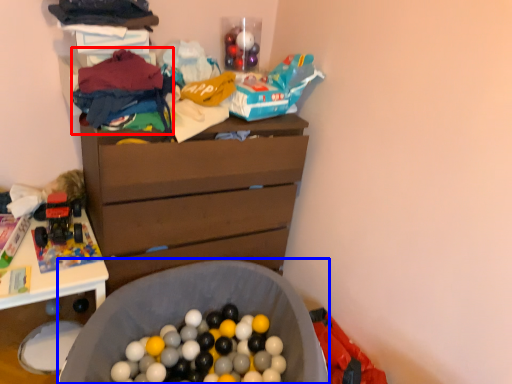
Question: Which point is further to the camera, clothing (highlighted by a red box) or laundry basket (highlighted by a blue box)?

Choices:
 (A) clothing
 (B) laundry basket

Answer: (A)